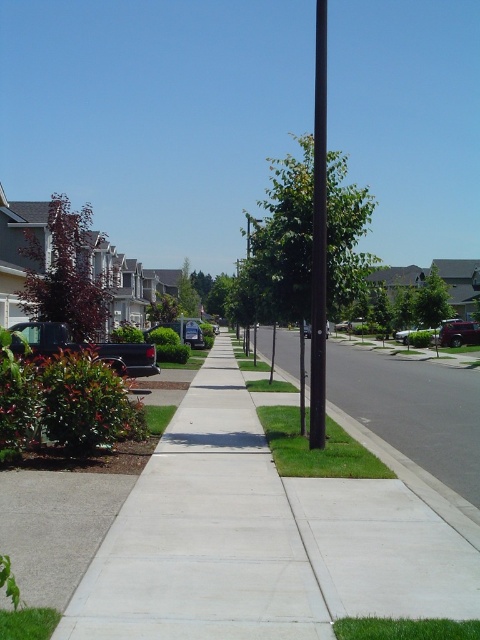
Question: Which point appears farthest from the camera in this image?

Choices:
 (A) (207, 497)
 (B) (451, 344)
 (C) (395, 336)

Answer: (C)

Question: Can you confirm if green concrete sidewalk at center is smaller than gray concrete sidewalk at lower right?

Choices:
 (A) yes
 (B) no

Answer: (A)

Question: Is gray concrete sidewalk at lower right smaller than metallic silver sedan at center-right?

Choices:
 (A) no
 (B) yes

Answer: (A)

Question: Estimate the real-world distances between objects in this image. Which object is farther from the metallic silver sedan at center-right?

Choices:
 (A) gray concrete sidewalk at lower right
 (B) black smooth pole at center

Answer: (B)

Question: Is black smooth pole at center thinner than metallic red car at right?

Choices:
 (A) no
 (B) yes

Answer: (A)

Question: Which point is closer to the camera?

Choices:
 (A) (436, 336)
 (B) (224, 410)

Answer: (B)